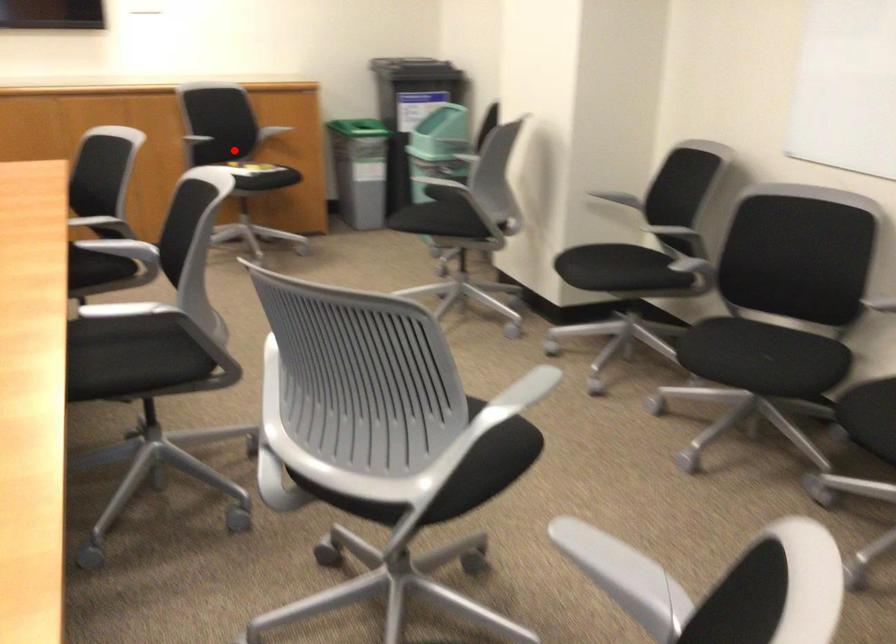
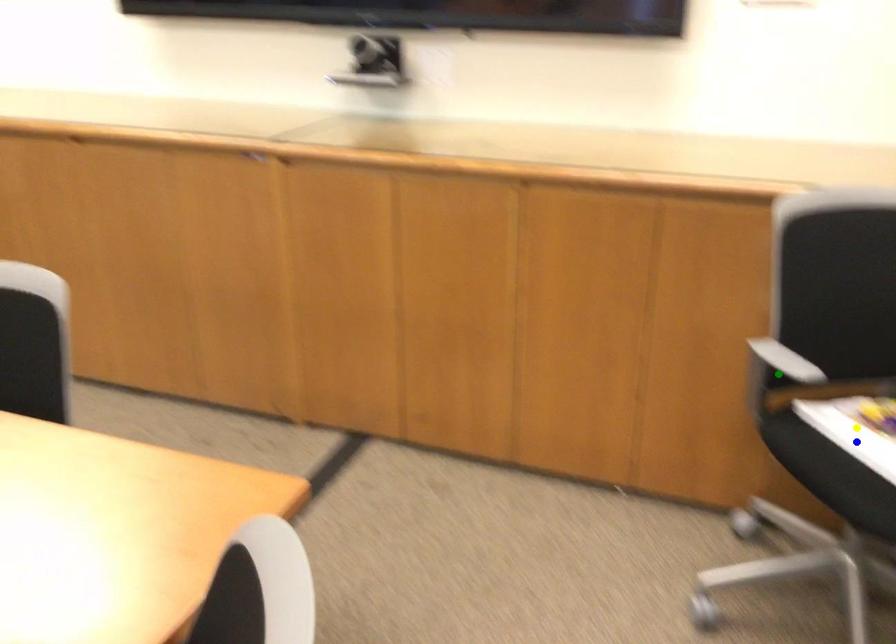
Question: I am providing you with two images of the same scene from different viewpoints. A red point is marked on the first image. You are given multiple points on the second image. Which spot in image 2 lines up with the point in image 1?

Choices:
 (A) yellow point
 (B) green point
 (C) blue point

Answer: (A)